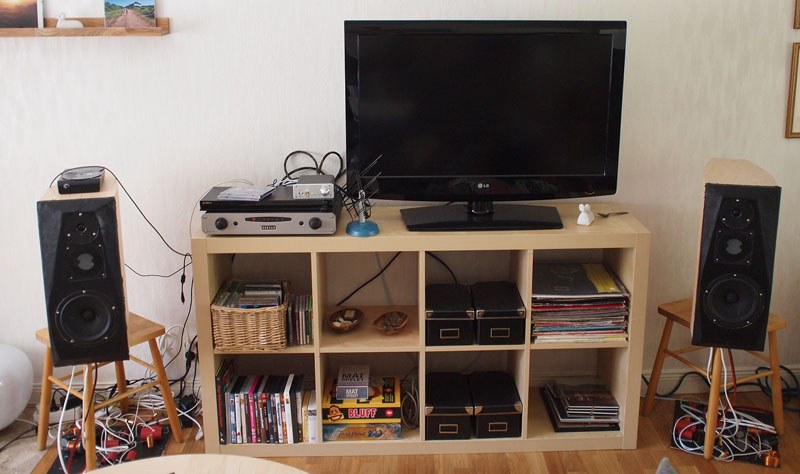
You are a GUI agent. You are given a task and a screenshot of the screen. Output one action in this format:
    pyautogui.click(x=<x>, y=<y>)
    Task: Click on the entertainment center/bookcase
    This screenshot has height=474, width=800.
    Given the screenshot: What is the action you would take?
    pyautogui.click(x=640, y=246)